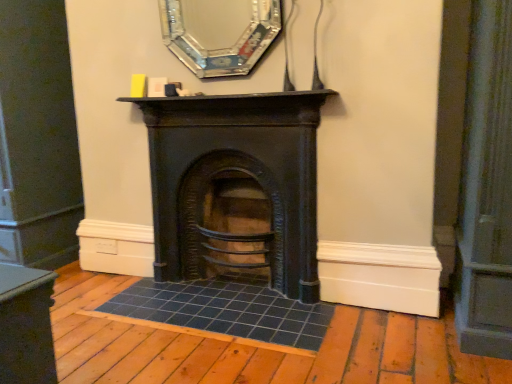
Question: Can you confirm if black cast iron fireplace at center is bigger than silver metallic mirror at upper center?

Choices:
 (A) yes
 (B) no

Answer: (A)

Question: Is black cast iron fireplace at center facing away from silver metallic mirror at upper center?

Choices:
 (A) yes
 (B) no

Answer: (B)

Question: Is black cast iron fireplace at center at the right side of silver metallic mirror at upper center?

Choices:
 (A) no
 (B) yes

Answer: (B)

Question: Does black cast iron fireplace at center have a lesser height compared to silver metallic mirror at upper center?

Choices:
 (A) yes
 (B) no

Answer: (B)

Question: From a real-world perspective, is black cast iron fireplace at center physically above silver metallic mirror at upper center?

Choices:
 (A) yes
 (B) no

Answer: (B)

Question: Considering the relative positions of black cast iron fireplace at center and silver metallic mirror at upper center in the image provided, is black cast iron fireplace at center in front of silver metallic mirror at upper center?

Choices:
 (A) yes
 (B) no

Answer: (B)

Question: Is silver metallic mirror at upper center taller than black cast iron fireplace at center?

Choices:
 (A) no
 (B) yes

Answer: (A)

Question: Is the depth of silver metallic mirror at upper center less than that of black cast iron fireplace at center?

Choices:
 (A) yes
 (B) no

Answer: (A)

Question: Considering the relative positions of silver metallic mirror at upper center and black cast iron fireplace at center in the image provided, is silver metallic mirror at upper center behind black cast iron fireplace at center?

Choices:
 (A) yes
 (B) no

Answer: (B)

Question: Considering the relative sizes of silver metallic mirror at upper center and black cast iron fireplace at center in the image provided, is silver metallic mirror at upper center smaller than black cast iron fireplace at center?

Choices:
 (A) no
 (B) yes

Answer: (B)

Question: Is the surface of silver metallic mirror at upper center in direct contact with black cast iron fireplace at center?

Choices:
 (A) yes
 (B) no

Answer: (B)

Question: Does silver metallic mirror at upper center appear on the right side of black cast iron fireplace at center?

Choices:
 (A) no
 (B) yes

Answer: (A)

Question: Considering their positions, is black cast iron fireplace at center located in front of or behind silver metallic mirror at upper center?

Choices:
 (A) behind
 (B) front

Answer: (A)